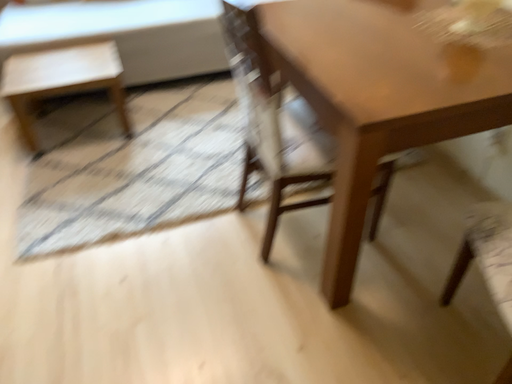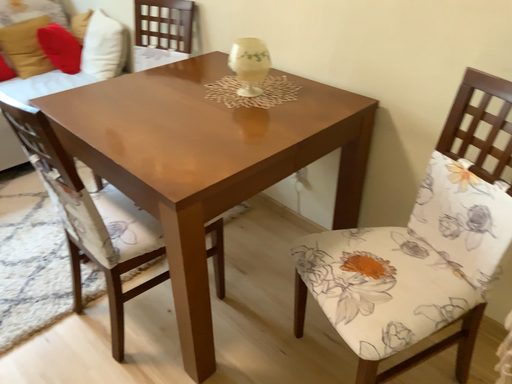
Question: Which way did the camera rotate in the video?

Choices:
 (A) rotated upward
 (B) rotated downward

Answer: (A)